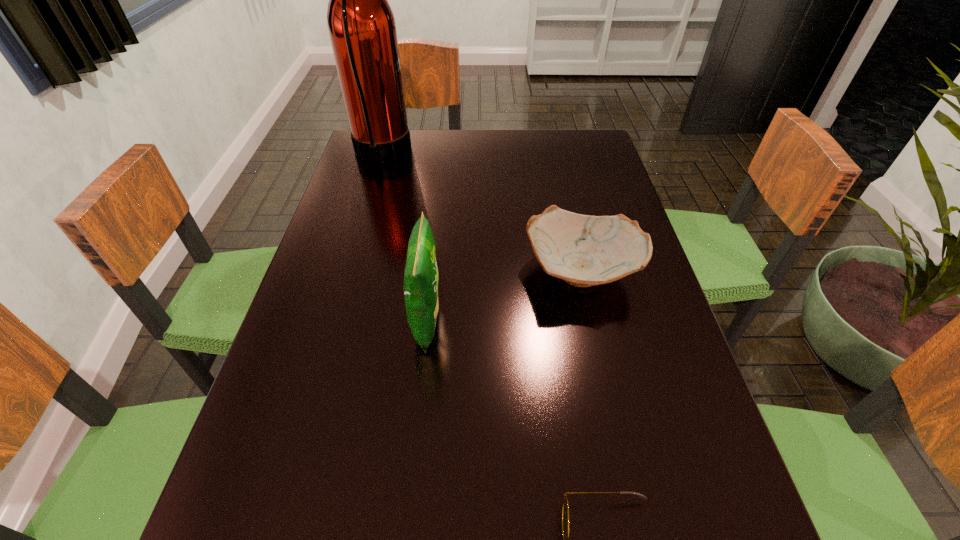
Identify the location of fire extinguisher. (361, 24).

This screenshot has height=540, width=960. I want to click on the leftmost object, so click(361, 24).

In order to click on crisp (potato chip) in this screenshot , I will do 421,277.

Locate an element on the screen. the second tallest object is located at coordinates (421, 277).

Find the location of a particular element. The height and width of the screenshot is (540, 960). the second shortest object is located at coordinates (584, 250).

You are a GUI agent. You are given a task and a screenshot of the screen. Output one action in this format:
    pyautogui.click(x=<x>, y=<y>)
    Task: Click on the vacant space situated on the front-facing side of the farthest object
    Image resolution: width=960 pixels, height=540 pixels.
    Given the screenshot: What is the action you would take?
    pyautogui.click(x=470, y=154)

Where is `free space located on the front-facing side of the third shortest object`? free space located on the front-facing side of the third shortest object is located at coordinates (591, 321).

You are a GUI agent. You are given a task and a screenshot of the screen. Output one action in this format:
    pyautogui.click(x=<x>, y=<y>)
    Task: Click on the vacant position located 0.180m on the back of the pottery
    The image size is (960, 540).
    Given the screenshot: What is the action you would take?
    tap(564, 193)

Where is `object located at the far edge`? This screenshot has width=960, height=540. object located at the far edge is located at coordinates (361, 24).

Image resolution: width=960 pixels, height=540 pixels. Find the location of `object that is at the left edge`. object that is at the left edge is located at coordinates (361, 24).